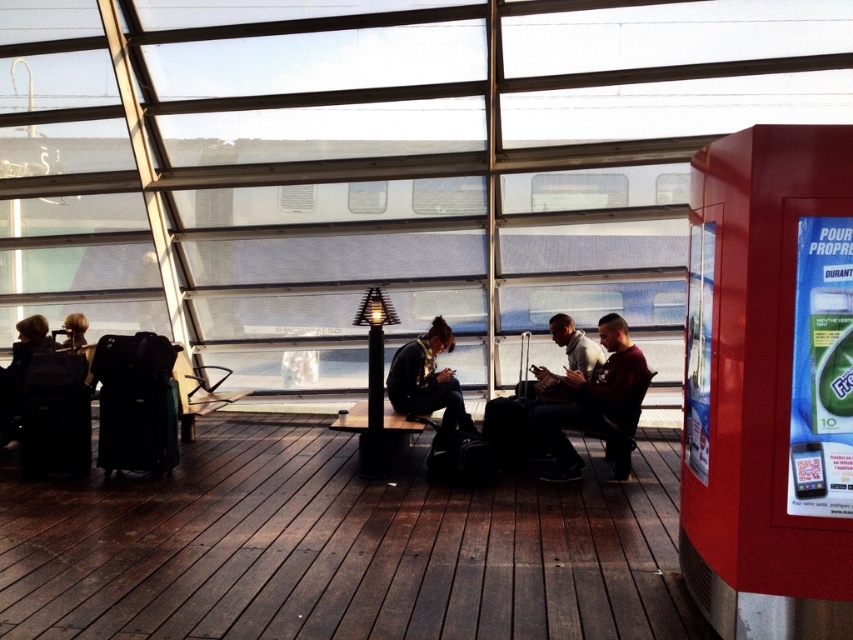
Question: Which point is closer to the camera?

Choices:
 (A) pos(628,355)
 (B) pos(596,380)

Answer: (A)

Question: Among these points, which one is farthest from the camera?

Choices:
 (A) 445,371
 (B) 691,333
 (C) 241,394
 (D) 579,400

Answer: (C)

Question: Does leather jacket at center have a larger size compared to metallic gray chair at center?

Choices:
 (A) yes
 (B) no

Answer: (B)

Question: Among these objects, which one is farthest from the camera?

Choices:
 (A) metallic gray chair at center
 (B) leather jacket at center
 (C) dark brown leather jacket at center

Answer: (A)

Question: Is white fleece jacket at center smaller than metallic gray chair at center?

Choices:
 (A) yes
 (B) no

Answer: (A)

Question: Can you confirm if dark brown leather jacket at center is bigger than metallic gray chair at center?

Choices:
 (A) yes
 (B) no

Answer: (B)